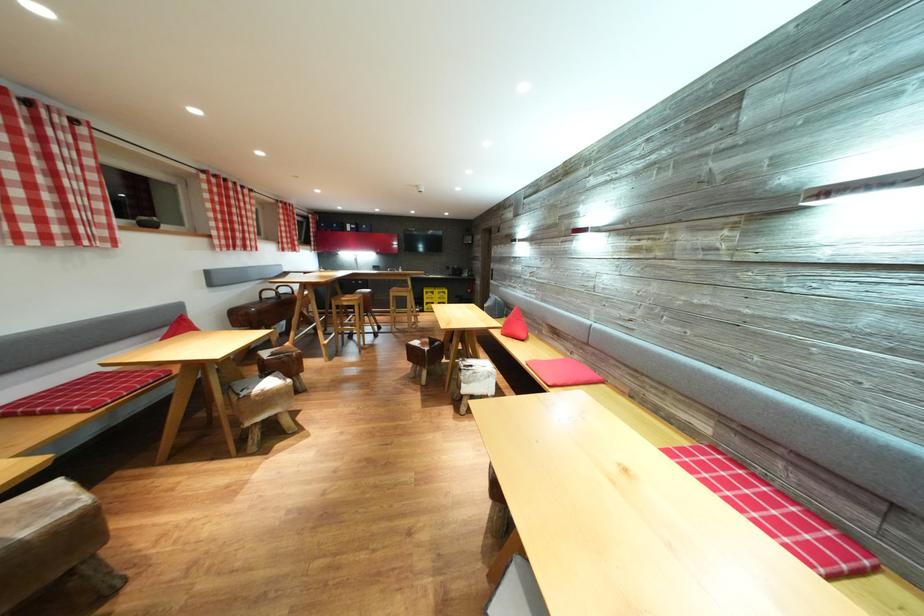
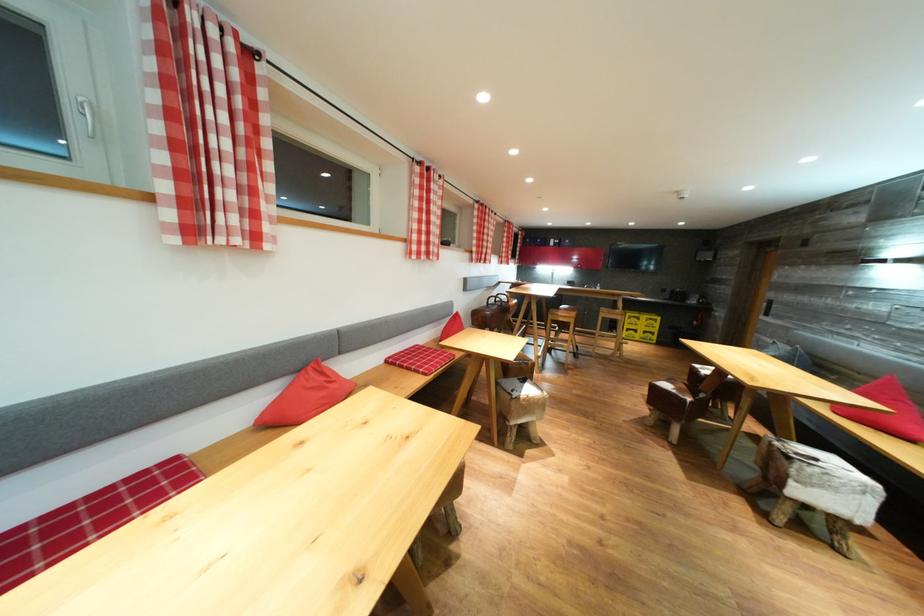
Locate, in the second image, the point that corresponds to [276,300] in the first image.

(499, 306)